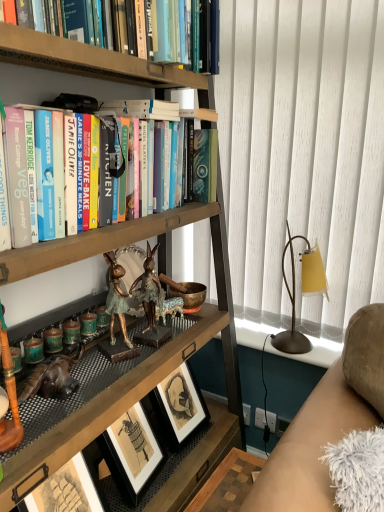
This screenshot has height=512, width=384. Describe the element at coordinates (302, 292) in the screenshot. I see `matte gold table lamp at right` at that location.

What are the coordinates of `suede-like beige couch at lower right` in the screenshot? It's located at [x=326, y=422].

What do you see at coordinates (326, 422) in the screenshot? I see `suede-like beige couch at lower right` at bounding box center [326, 422].

The height and width of the screenshot is (512, 384). I want to click on wooden bookshelf at center, so click(145, 360).

The width and height of the screenshot is (384, 512). What do you see at coordinates (145, 360) in the screenshot?
I see `wooden bookshelf at center` at bounding box center [145, 360].

What do you see at coordinates (303, 152) in the screenshot? I see `white fabric curtain at right` at bounding box center [303, 152].

The image size is (384, 512). I want to click on hardcover books at upper left, so click(199, 206).

Considering the sizes of objects hardcover books at upper left and gold metallic rabbit at center in the image provided, who is thinner, hardcover books at upper left or gold metallic rabbit at center?

With smaller width is gold metallic rabbit at center.

Is hardcover books at upper left oriented towards gold metallic rabbit at center?

No, hardcover books at upper left is not oriented towards gold metallic rabbit at center.

From the image's perspective, does hardcover books at upper left appear higher than gold metallic rabbit at center?

Indeed, from the image's perspective, hardcover books at upper left is shown above gold metallic rabbit at center.

In terms of size, does hardcover books at upper left appear bigger or smaller than gold metallic rabbit at center?

In the image, hardcover books at upper left appears to be larger than gold metallic rabbit at center.

Measure the distance from hardcover books at upper left to wooden bookshelf at center.

A distance of 9.62 inches exists between hardcover books at upper left and wooden bookshelf at center.

Considering the sizes of objects hardcover books at upper left and wooden bookshelf at center in the image provided, who is shorter, hardcover books at upper left or wooden bookshelf at center?

With less height is hardcover books at upper left.

You are a GUI agent. You are given a task and a screenshot of the screen. Output one action in this format:
    pyautogui.click(x=<x>, y=<y>)
    Task: Click on the book above the wooden bookshelf at center (from a real-world perspective)
    The height and width of the screenshot is (512, 384).
    Given the screenshot: What is the action you would take?
    point(199,206)

From the image's perspective, which object appears higher, hardcover books at upper left or wooden bookshelf at center?

hardcover books at upper left appears higher in the image.

Which object is thinner, hardcover books at upper left or white fabric curtain at right?

white fabric curtain at right is thinner.

Is hardcover books at upper left taller or shorter than white fabric curtain at right?

Clearly, hardcover books at upper left is shorter compared to white fabric curtain at right.

How many degrees apart are the facing directions of hardcover books at upper left and white fabric curtain at right?

The angle between the facing direction of hardcover books at upper left and the facing direction of white fabric curtain at right is 89 degrees.

Measure the distance from hardcover books at upper left to white fabric curtain at right.

hardcover books at upper left is 18.19 inches from white fabric curtain at right.

Considering the positions of objects wooden bookshelf at center and matte gold table lamp at right in the image provided, who is behind, wooden bookshelf at center or matte gold table lamp at right?

matte gold table lamp at right is further from the camera.

Does point (233, 413) lie in front of point (284, 275)?

Yes, it is.

Is wooden bookshelf at center taller than matte gold table lamp at right?

Correct, wooden bookshelf at center is much taller as matte gold table lamp at right.

Is wooden bookshelf at center positioned far away from matte gold table lamp at right?

wooden bookshelf at center is near matte gold table lamp at right, not far away.

Does hardcover books at upper left appear on the right side of suede-like beige couch at lower right?

Incorrect, hardcover books at upper left is not on the right side of suede-like beige couch at lower right.

Is point (202, 110) closer to camera compared to point (278, 449)?

No, (202, 110) is further to viewer.

Looking at their sizes, would you say wooden bookshelf at center is wider or thinner than suede-like beige couch at lower right?

Considering their sizes, wooden bookshelf at center looks broader than suede-like beige couch at lower right.

In the scene shown: How different are the orientations of wooden bookshelf at center and suede-like beige couch at lower right in degrees?

44 degrees separate the facing orientations of wooden bookshelf at center and suede-like beige couch at lower right.

From a real-world perspective, is wooden bookshelf at center on top of suede-like beige couch at lower right?

Yes, from a real-world perspective, wooden bookshelf at center is above suede-like beige couch at lower right.

Is wooden bookshelf at center not close to suede-like beige couch at lower right?

No, wooden bookshelf at center is not far from suede-like beige couch at lower right.

Considering the sizes of objects gold metallic rabbit at center and wooden bookshelf at center in the image provided, who is smaller, gold metallic rabbit at center or wooden bookshelf at center?

gold metallic rabbit at center.

From a real-world perspective, is gold metallic rabbit at center beneath wooden bookshelf at center?

No, from a real-world perspective, gold metallic rabbit at center is not beneath wooden bookshelf at center.

From the image's perspective, who appears lower, gold metallic rabbit at center or wooden bookshelf at center?

From the image's view, wooden bookshelf at center is below.

Is gold metallic rabbit at center oriented away from wooden bookshelf at center?

Correct, gold metallic rabbit at center is looking away from wooden bookshelf at center.

Identify the location of animal behind the hardcover books at upper left. (116, 298).

Locate an element on the screen. bookcase on the right of hardcover books at upper left is located at coordinates (145, 360).

Considering their positions, is wooden bookshelf at center positioned closer to gold metallic rabbit at center than hardcover books at upper left?

Among the two, hardcover books at upper left is located nearer to gold metallic rabbit at center.

Which object lies further to the anchor point matte gold table lamp at right, hardcover books at upper left or white fabric curtain at right?

hardcover books at upper left is further to matte gold table lamp at right.

Looking at the image, which one is located further to matte gold table lamp at right, white fabric curtain at right or hardcover books at upper left?

hardcover books at upper left.

Based on the photo, when comparing their distances from matte gold table lamp at right, does hardcover books at upper left or wooden bookshelf at center seem closer?

The object closer to matte gold table lamp at right is wooden bookshelf at center.

Estimate the real-world distances between objects in this image. Which object is closer to matte gold table lamp at right, wooden bookshelf at center or gold metallic rabbit at center?

wooden bookshelf at center is closer to matte gold table lamp at right.

Looking at the image, which one is located further to wooden bookshelf at center, gold metallic rabbit at center or hardcover books at upper left?

The object further to wooden bookshelf at center is gold metallic rabbit at center.

Which object lies nearer to the anchor point white fabric curtain at right, suede-like beige couch at lower right or gold metallic rabbit at center?

suede-like beige couch at lower right is closer to white fabric curtain at right.

When comparing their distances from hardcover books at upper left, does suede-like beige couch at lower right or white fabric curtain at right seem further?

suede-like beige couch at lower right lies further to hardcover books at upper left than the other object.

Identify the location of curtain positioned between wooden bookshelf at center and matte gold table lamp at right from near to far. The image size is (384, 512). (303, 152).

I want to click on animal between suede-like beige couch at lower right and matte gold table lamp at right from front to back, so click(116, 298).

Locate an element on the screen. This screenshot has width=384, height=512. curtain located between hardcover books at upper left and matte gold table lamp at right in the depth direction is located at coordinates (303, 152).

Where is `book between suede-like beige couch at lower right and matte gold table lamp at right from front to back`? The width and height of the screenshot is (384, 512). book between suede-like beige couch at lower right and matte gold table lamp at right from front to back is located at coordinates coord(199,206).